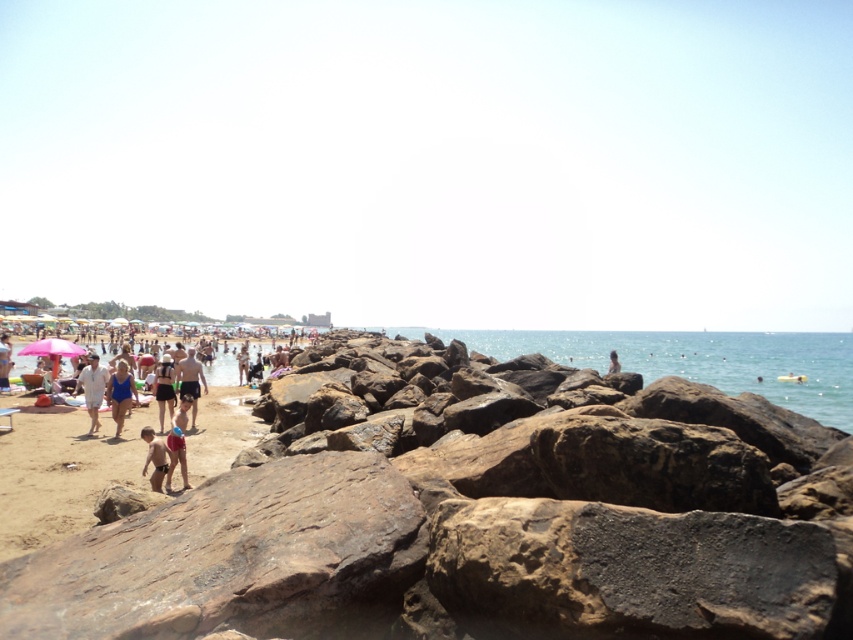
Question: Which point is farther to the camera?

Choices:
 (A) (85, 369)
 (B) (701, 492)

Answer: (A)

Question: Which point is closer to the camera taking this photo?

Choices:
 (A) (527, 528)
 (B) (169, 448)
 (C) (190, 372)
 (D) (158, 380)

Answer: (A)

Question: Can you confirm if matte black swimsuit at center is smaller than smooth skin person at center?

Choices:
 (A) no
 (B) yes

Answer: (B)

Question: Does matte black swimsuit at center have a smaller size compared to matte white swimsuit at lower left?

Choices:
 (A) yes
 (B) no

Answer: (B)

Question: Which point is closer to the camera taking this photo?

Choices:
 (A) (152, 445)
 (B) (572, 193)

Answer: (A)

Question: Is transparent sand at lower left to the right of green fabric shorts at center from the viewer's perspective?

Choices:
 (A) yes
 (B) no

Answer: (A)